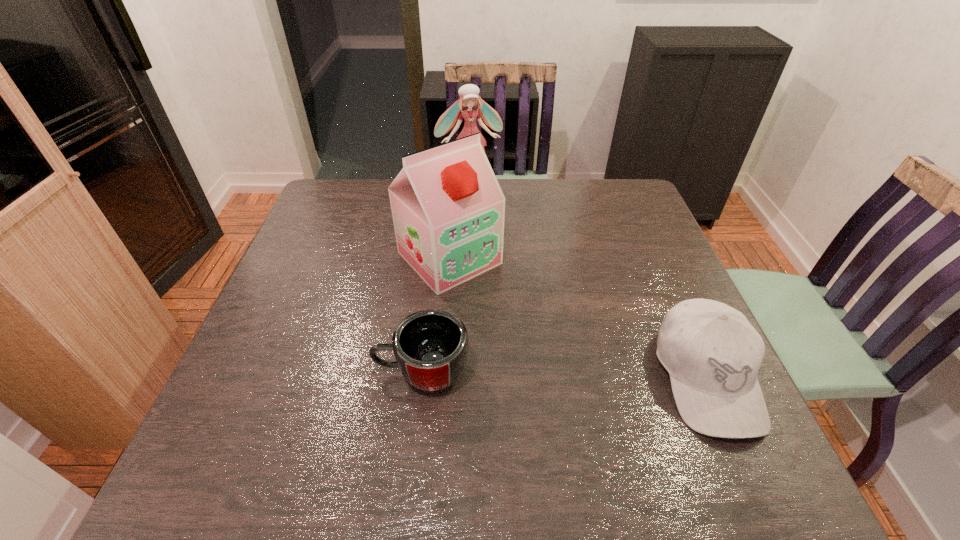
The height and width of the screenshot is (540, 960). I want to click on the shortest object, so click(430, 346).

Locate an element on the screen. baseball cap is located at coordinates (712, 353).

The width and height of the screenshot is (960, 540). I want to click on the rightmost object, so click(712, 353).

I want to click on soya milk, so click(x=448, y=209).

You are a GUI agent. You are given a task and a screenshot of the screen. Output one action in this format:
    pyautogui.click(x=<x>, y=<y>)
    Task: Click on the doll
    This screenshot has height=540, width=960.
    Given the screenshot: What is the action you would take?
    pyautogui.click(x=469, y=98)

Find the location of a particular element. The width and height of the screenshot is (960, 540). free location located on the side of the mug with the handle is located at coordinates (240, 372).

At what (x,y) coordinates should I click in order to perform the action: click on vacant space located 0.270m on the side of the mug with the handle. Please return your answer as a coordinate pair (x, y). Looking at the image, I should click on (245, 372).

Locate an element on the screen. free space located on the side of the mug with the handle is located at coordinates (250, 372).

Find the location of a particular element. blank area located 0.240m with the cap open on the third nearest object is located at coordinates (545, 350).

You are a GUI agent. You are given a task and a screenshot of the screen. Output one action in this format:
    pyautogui.click(x=<x>, y=<y>)
    Task: Click on the vacant space positioned with the cap open on the third nearest object
    This screenshot has height=540, width=960.
    Given the screenshot: What is the action you would take?
    pyautogui.click(x=599, y=403)